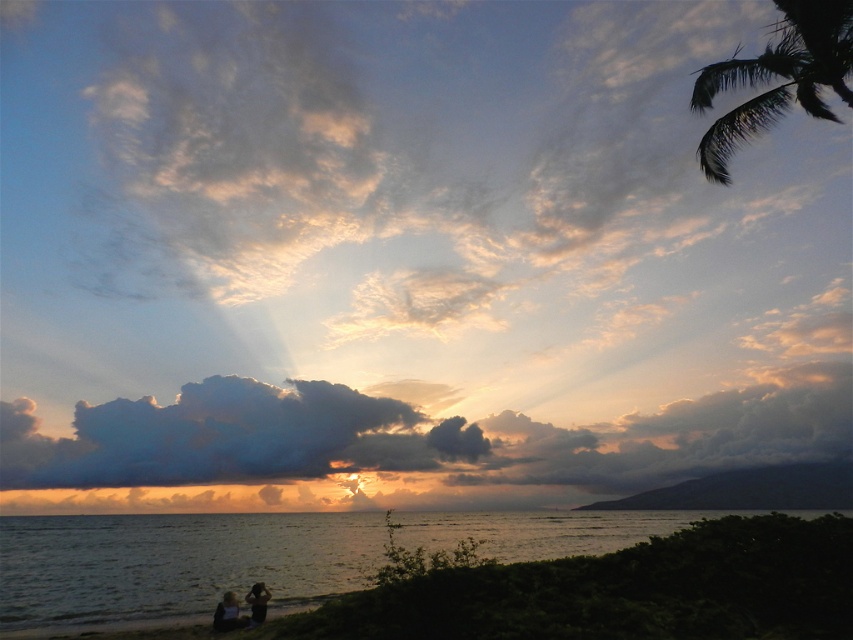
You are standing at the beach and want to take a photo of the smooth skin person at lower left without any obstructions. Is the dark green leafy palm tree at upper right blocking your view?

The dark green leafy palm tree at upper right is in front of the smooth skin person at lower left, so it would block your view when taking a photo.

You are a photographer planning to capture a sunset scene similar to the one described. You want to ensure that both the silvery metallic couple at lower center and the smooth skin person at lower left are clearly visible in your photo. Given their sizes, which subject should you focus on to ensure they are both in frame and properly sized?

The silvery metallic couple at lower center is larger than the smooth skin person at lower left. To ensure both are clearly visible, focus on the silvery metallic couple at lower center as the primary subject, allowing the smaller smooth skin person at lower left to be included in the composition without being too small.

You are a photographer planning to take a group photo of the smooth skin person at lower left and the smooth skin person at lower center. Based on their positions in the image, which person should stand closer to the camera to ensure both appear equally wide in the final photo?

The smooth skin person at lower left might be wider than the smooth skin person at lower center, so the person at lower left should move further away from the camera, while the person at lower center should move closer to balance their apparent widths.